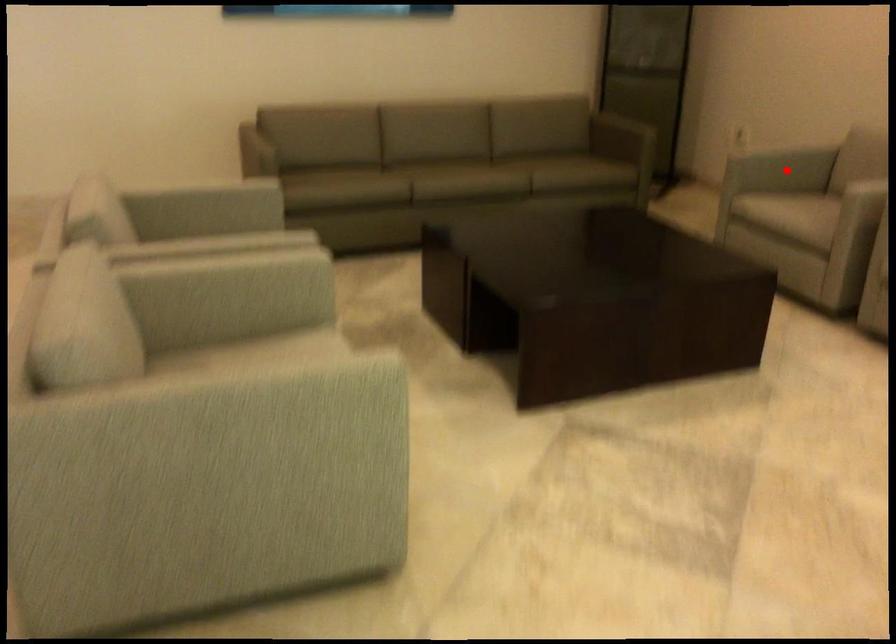
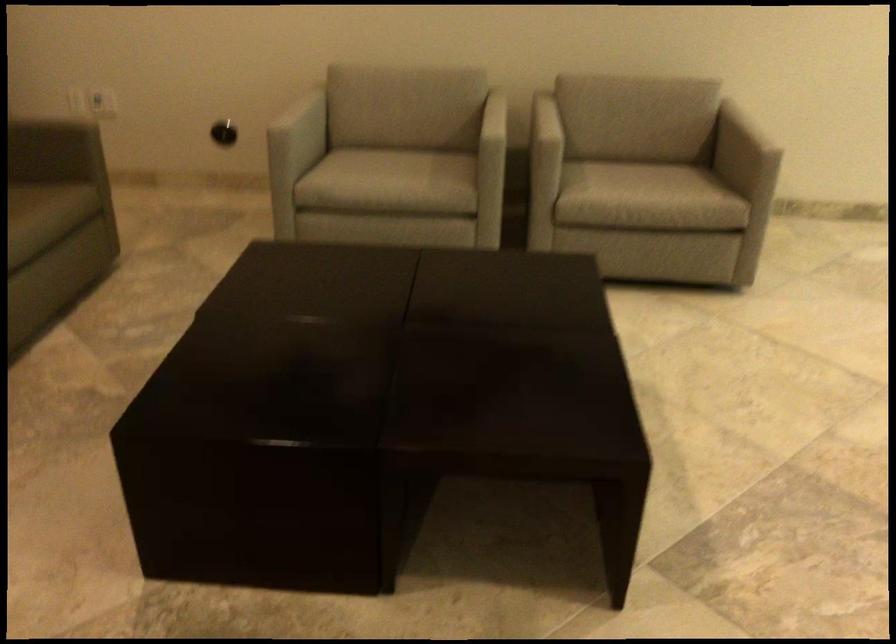
Locate, in the second image, the point that corresponds to the highlighted location in the first image.

(304, 124)